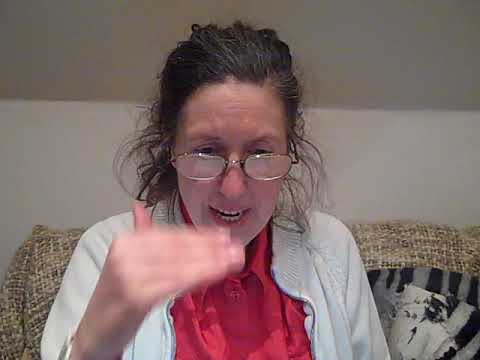
Locate an element on the screen. Image resolution: width=480 pixels, height=360 pixels. pillow is located at coordinates (458, 288).